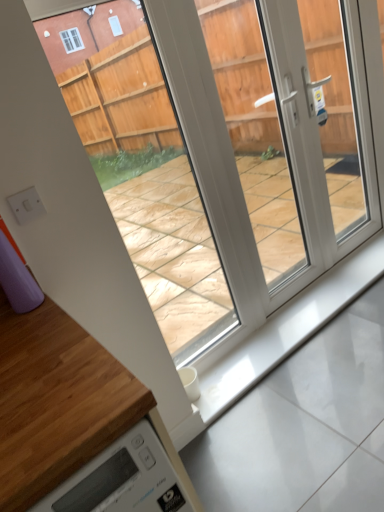
Question: From a real-world perspective, is wooden at lower left above or below transparent plastic glass door at center?

Choices:
 (A) above
 (B) below

Answer: (B)

Question: Which is correct: wooden at lower left is inside transparent plastic glass door at center, or outside of it?

Choices:
 (A) inside
 (B) outside

Answer: (B)

Question: Based on their relative distances, which object is farther from the transparent plastic glass door at center?

Choices:
 (A) wooden at lower left
 (B) white glossy concrete at bottom

Answer: (A)

Question: Based on their relative distances, which object is nearer to the wooden at lower left?

Choices:
 (A) transparent plastic glass door at center
 (B) white glossy concrete at bottom

Answer: (B)